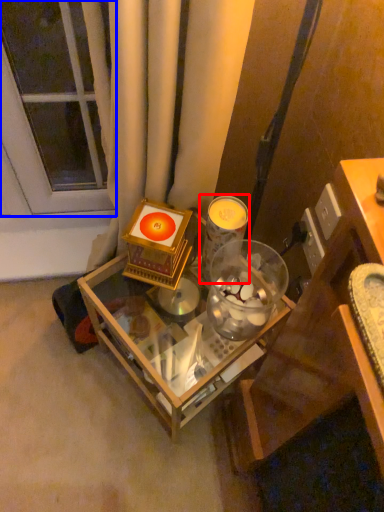
Question: Which object appears closest to the camera in this image, candle holder (highlighted by a red box) or glass door (highlighted by a blue box)?

Choices:
 (A) candle holder
 (B) glass door

Answer: (A)